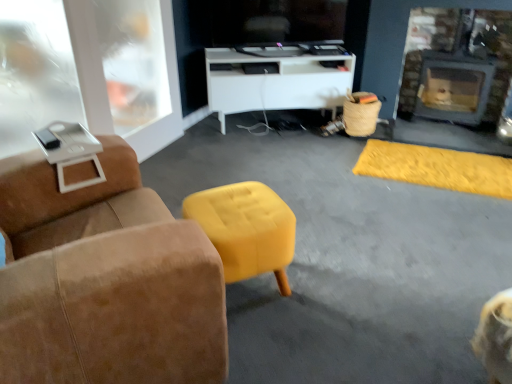
Question: Can you confirm if brick fireplace at right is positioned to the right of white glossy cabinet at center?

Choices:
 (A) yes
 (B) no

Answer: (A)

Question: Would you say white glossy cabinet at center is part of brick fireplace at right's contents?

Choices:
 (A) yes
 (B) no

Answer: (B)

Question: Is white glossy cabinet at center at the back of brick fireplace at right?

Choices:
 (A) no
 (B) yes

Answer: (A)

Question: Is brick fireplace at right bigger than white glossy cabinet at center?

Choices:
 (A) no
 (B) yes

Answer: (A)

Question: Can you confirm if brick fireplace at right is positioned to the left of white glossy cabinet at center?

Choices:
 (A) no
 (B) yes

Answer: (A)

Question: In terms of size, does yellow fabric stool at center appear bigger or smaller than brick fireplace at right?

Choices:
 (A) big
 (B) small

Answer: (B)

Question: Which is correct: yellow fabric stool at center is inside brick fireplace at right, or outside of it?

Choices:
 (A) outside
 (B) inside

Answer: (A)

Question: Relative to brick fireplace at right, is yellow fabric stool at center in front or behind?

Choices:
 (A) behind
 (B) front

Answer: (B)

Question: In terms of width, does yellow fabric stool at center look wider or thinner when compared to brick fireplace at right?

Choices:
 (A) thin
 (B) wide

Answer: (B)

Question: Is brick fireplace at right spatially inside yellow fabric stool at center, or outside of it?

Choices:
 (A) outside
 (B) inside

Answer: (A)

Question: In the image, is brick fireplace at right positioned in front of or behind yellow fabric stool at center?

Choices:
 (A) behind
 (B) front

Answer: (A)

Question: From the image's perspective, is brick fireplace at right above or below yellow fabric stool at center?

Choices:
 (A) below
 (B) above

Answer: (B)

Question: Considering the relative positions of brick fireplace at right and yellow fabric stool at center in the image provided, is brick fireplace at right to the left or to the right of yellow fabric stool at center?

Choices:
 (A) left
 (B) right

Answer: (B)

Question: Does point (10, 327) appear closer or farther from the camera than point (245, 220)?

Choices:
 (A) closer
 (B) farther

Answer: (A)

Question: From the image's perspective, is suede armchair at left positioned above or below yellow fabric stool at center?

Choices:
 (A) above
 (B) below

Answer: (A)